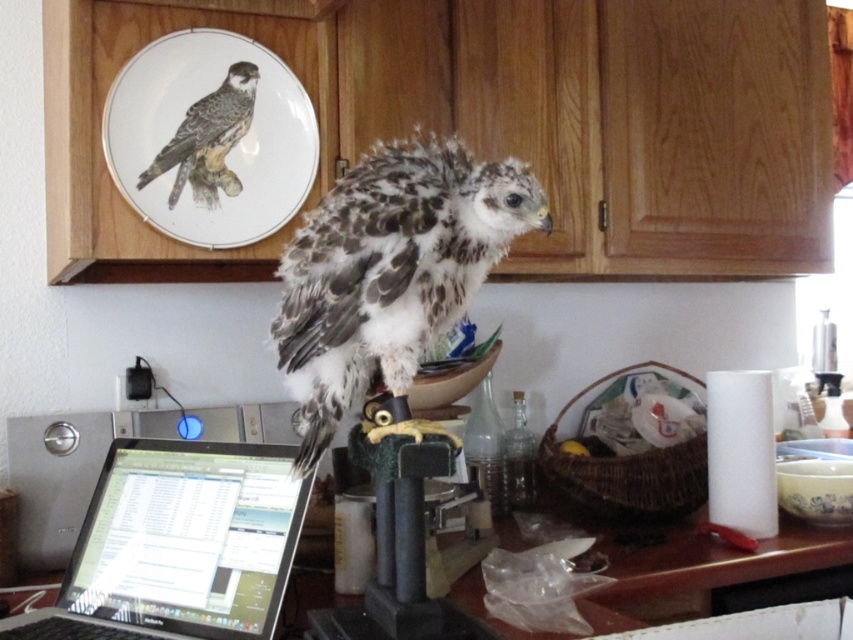
Question: Which point is farther to the camera?

Choices:
 (A) white porcelain plate at upper center
 (B) black glossy laptop at lower left
 (C) dark gray feathers at upper left

Answer: (C)

Question: Is speckled feathered falcon at center above white porcelain plate at upper center?

Choices:
 (A) no
 (B) yes

Answer: (A)

Question: Is speckled feathered falcon at center below dark gray feathers at upper left?

Choices:
 (A) yes
 (B) no

Answer: (A)

Question: Observing the image, what is the correct spatial positioning of black glossy laptop at lower left in reference to white porcelain plate at upper center?

Choices:
 (A) below
 (B) above

Answer: (A)

Question: Which object appears farthest from the camera in this image?

Choices:
 (A) dark gray feathers at upper left
 (B) black glossy laptop at lower left

Answer: (A)

Question: Which point appears closest to the camera in this image?

Choices:
 (A) (225, 115)
 (B) (90, 509)
 (C) (305, 230)
 (D) (251, 138)

Answer: (C)